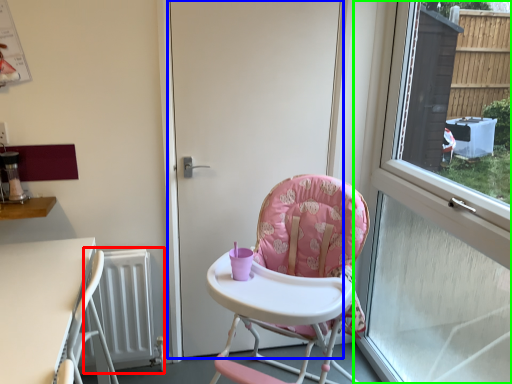
Question: Considering the real-world distances, which object is farthest from radiator (highlighted by a red box)? door (highlighted by a blue box) or window (highlighted by a green box)?

Choices:
 (A) door
 (B) window

Answer: (B)